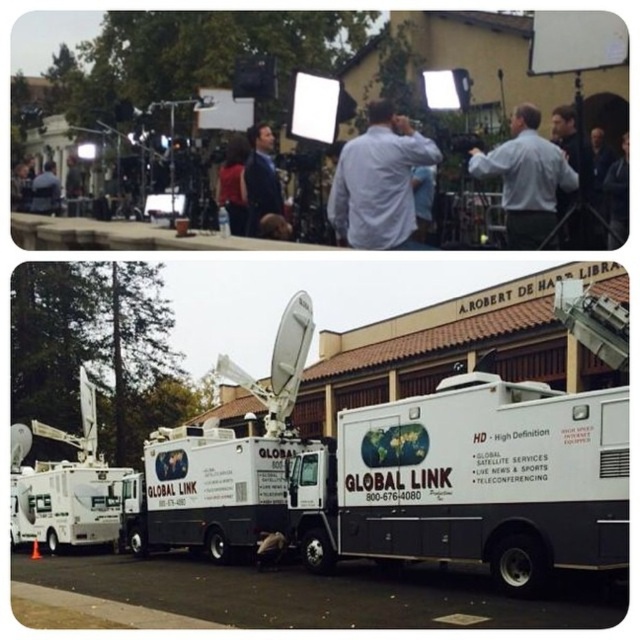
Question: Does matte red shirt at center appear on the left side of matte black jacket at left?

Choices:
 (A) yes
 (B) no

Answer: (B)

Question: Which point appears closest to the camera in this image?

Choices:
 (A) (608, 176)
 (B) (378, 138)
 (C) (36, 196)
 (D) (500, 204)

Answer: (A)

Question: Is the position of matte red shirt at center less distant than that of matte black jacket at left?

Choices:
 (A) yes
 (B) no

Answer: (A)

Question: Which of the following is the farthest from the observer?

Choices:
 (A) matte black jacket at left
 (B) dark blue jacket at upper right
 (C) dark blue suit at center

Answer: (A)

Question: Based on their relative distances, which object is farther from the dark blue suit at center?

Choices:
 (A) matte red shirt at center
 (B) dark blue jacket at upper right
 (C) white shirt at center
 (D) light blue shirt at center

Answer: (B)

Question: In this image, where is matte red shirt at center located relative to matte black jacket at left?

Choices:
 (A) right
 (B) left

Answer: (A)